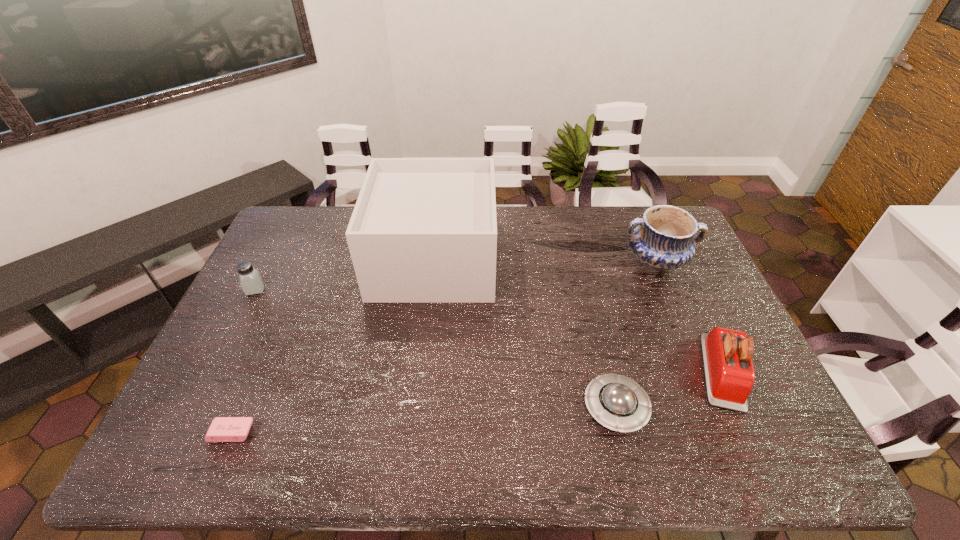
Locate an element on the screen. The width and height of the screenshot is (960, 540). vacant region that satisfies the following two spatial constraints: 1. on the back side of the shortest object; 2. on the right side of the toaster is located at coordinates (258, 372).